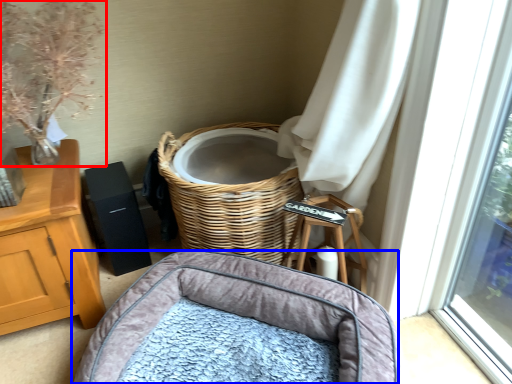
Question: Which point is further to the camera, floral arrangement (highlighted by a red box) or infant bed (highlighted by a blue box)?

Choices:
 (A) floral arrangement
 (B) infant bed

Answer: (A)